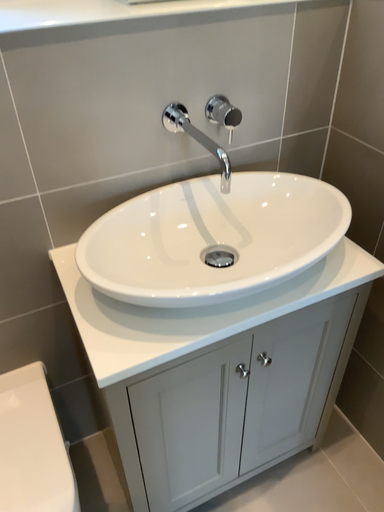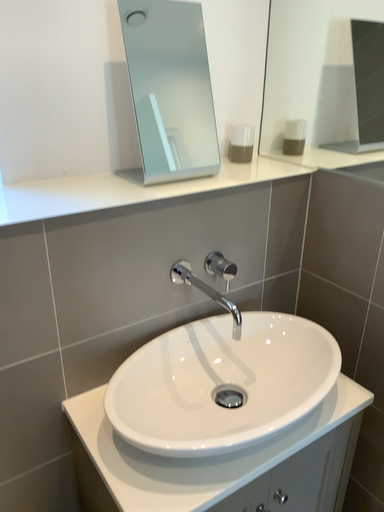
Question: Which way did the camera rotate in the video?

Choices:
 (A) rotated right
 (B) rotated left

Answer: (A)